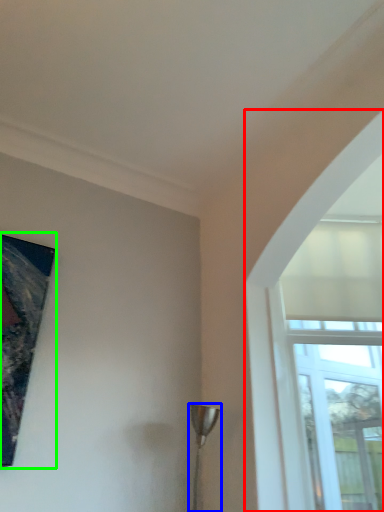
Question: Based on their relative distances, which object is nearer to window (highlighted by a red box)? Choose from lamp (highlighted by a blue box) and picture frame (highlighted by a green box).

Choices:
 (A) lamp
 (B) picture frame

Answer: (A)